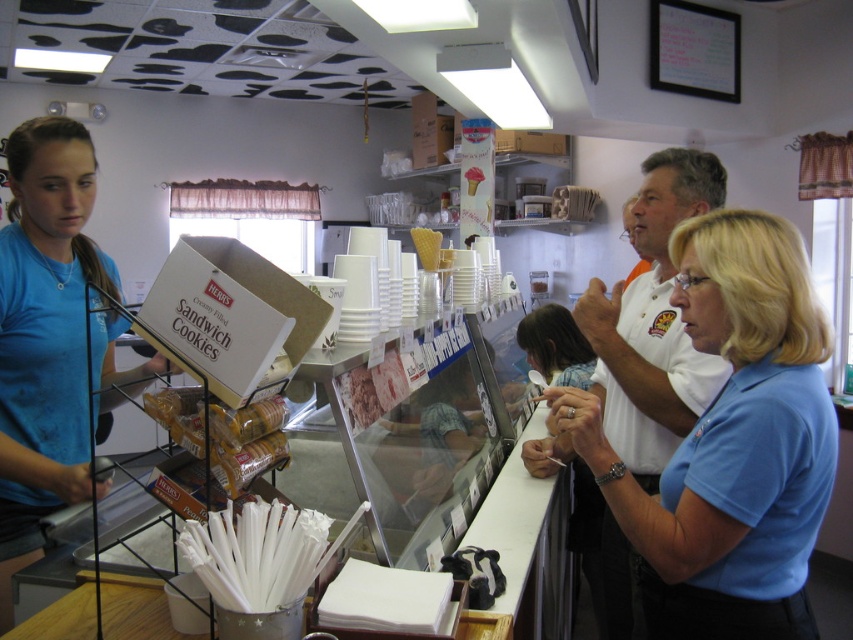
Question: Which point is farther to the camera?

Choices:
 (A) (674, 531)
 (B) (199, 433)

Answer: (A)

Question: Considering the relative positions of blue cotton shirt at center and golden brown sandwich cookies at center in the image provided, where is blue cotton shirt at center located with respect to golden brown sandwich cookies at center?

Choices:
 (A) below
 (B) above

Answer: (A)

Question: Which point appears closest to the camera in this image?

Choices:
 (A) (757, 292)
 (B) (45, 362)
 (C) (270, 445)

Answer: (A)

Question: Is blue cotton shirt at left closer to the viewer compared to golden brown sandwich cookies at center?

Choices:
 (A) no
 (B) yes

Answer: (A)

Question: Considering the real-world distances, which object is closest to the blue cotton shirt at center?

Choices:
 (A) blue cotton shirt at left
 (B) golden brown sandwich cookies at center

Answer: (B)

Question: From the image, what is the correct spatial relationship of blue cotton shirt at center in relation to blue cotton shirt at left?

Choices:
 (A) below
 (B) above

Answer: (A)